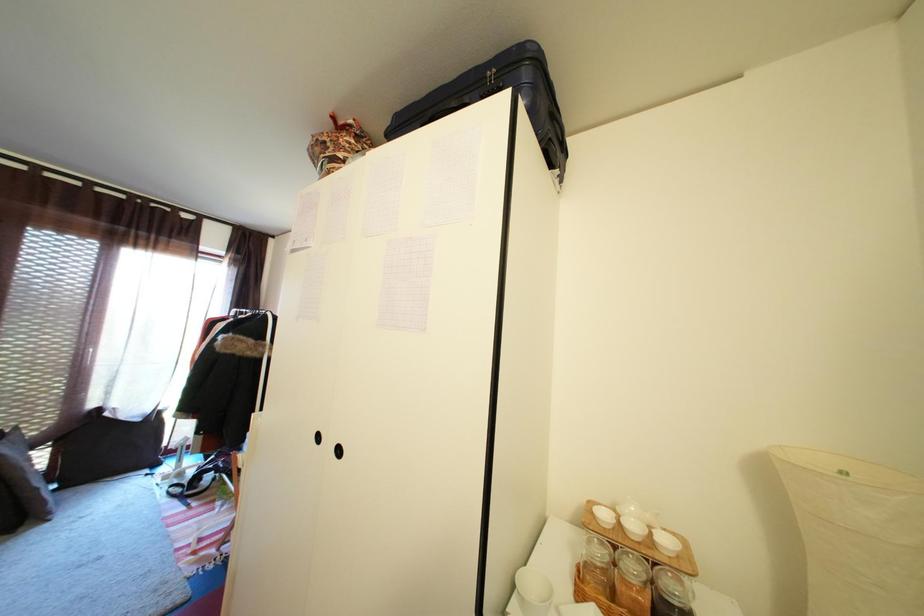
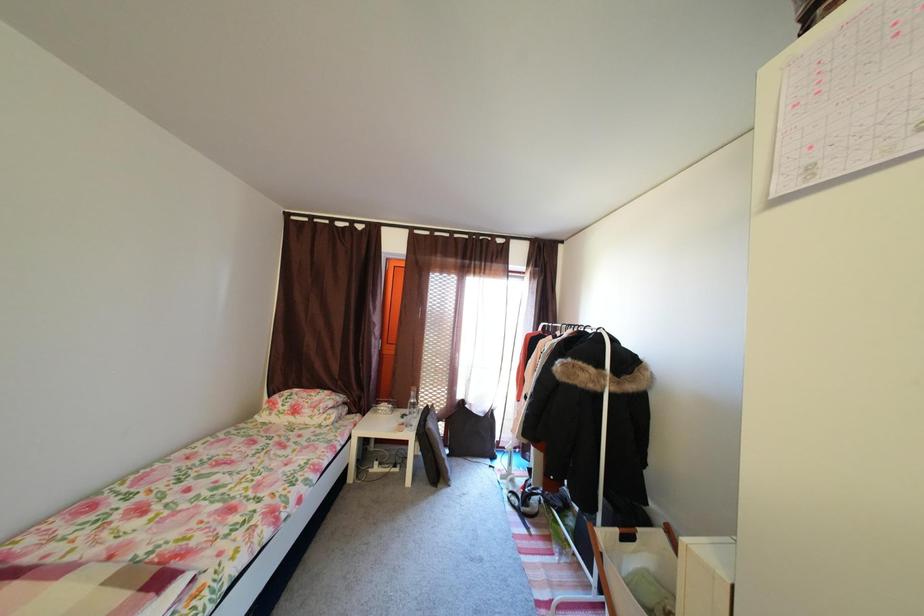
Question: How did the camera likely rotate?

Choices:
 (A) Left
 (B) Right
 (C) Up
 (D) Down

Answer: (A)